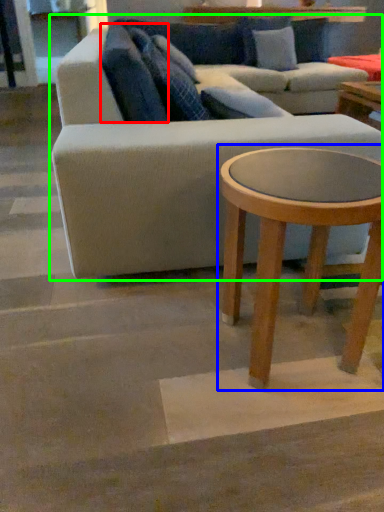
Question: Which object is the farthest from pillow (highlighted by a red box)? Choose among these: coffee table (highlighted by a blue box) or studio couch (highlighted by a green box).

Choices:
 (A) coffee table
 (B) studio couch

Answer: (A)